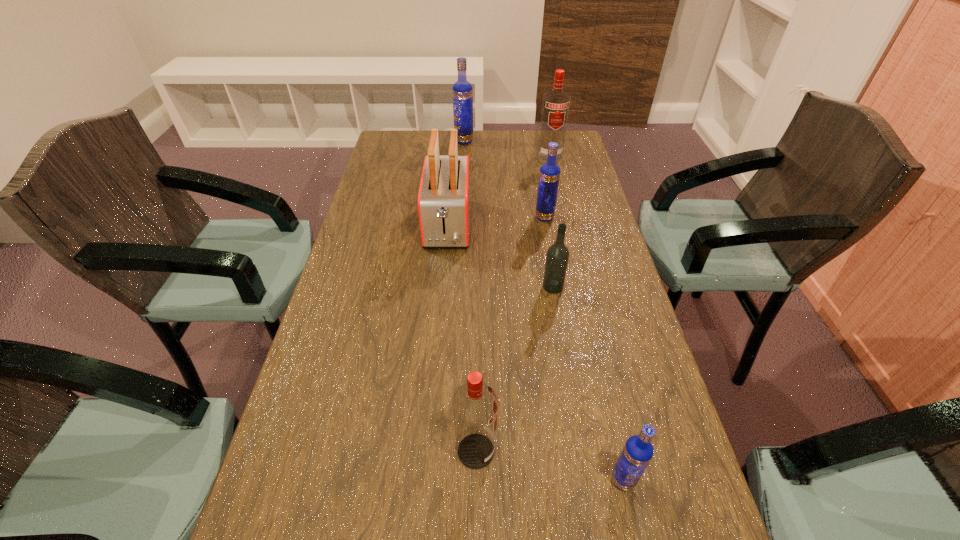
Find the location of a particular element. The height and width of the screenshot is (540, 960). unoccupied position between the smaller red vodka and the black vodka is located at coordinates (515, 369).

Where is `free point between the toaster and the third nearest vodka`? free point between the toaster and the third nearest vodka is located at coordinates (500, 256).

Locate an element on the screen. free space between the biggest blue vodka and the bigger red vodka is located at coordinates pyautogui.click(x=507, y=148).

Identify which object is the sixth closest to the smallest blue vodka. Please provide its 2D coordinates. Your answer should be formatted as a tuple, i.e. [(x, y)], where the tuple contains the x and y coordinates of a point satisfying the conditions above.

[(462, 90)]

Identify which object is located as the fifth nearest to the red toaster. Please provide its 2D coordinates. Your answer should be formatted as a tuple, i.e. [(x, y)], where the tuple contains the x and y coordinates of a point satisfying the conditions above.

[(475, 404)]

Select which vodka appears as the fifth closest to the black vodka. Please provide its 2D coordinates. Your answer should be formatted as a tuple, i.e. [(x, y)], where the tuple contains the x and y coordinates of a point satisfying the conditions above.

[(462, 90)]

The image size is (960, 540). In order to click on vodka identified as the fifth closest to the farther red vodka in this screenshot , I will do `click(638, 451)`.

You are a GUI agent. You are given a task and a screenshot of the screen. Output one action in this format:
    pyautogui.click(x=<x>, y=<y>)
    Task: Click on the blue vodka that can be found as the second closest to the second smallest blue vodka
    
    Given the screenshot: What is the action you would take?
    pyautogui.click(x=638, y=451)

Identify which blue vodka is the second nearest to the second smallest blue vodka. Please provide its 2D coordinates. Your answer should be formatted as a tuple, i.e. [(x, y)], where the tuple contains the x and y coordinates of a point satisfying the conditions above.

[(638, 451)]

I want to click on the closest red vodka relative to the fifth farthest object, so click(x=475, y=404).